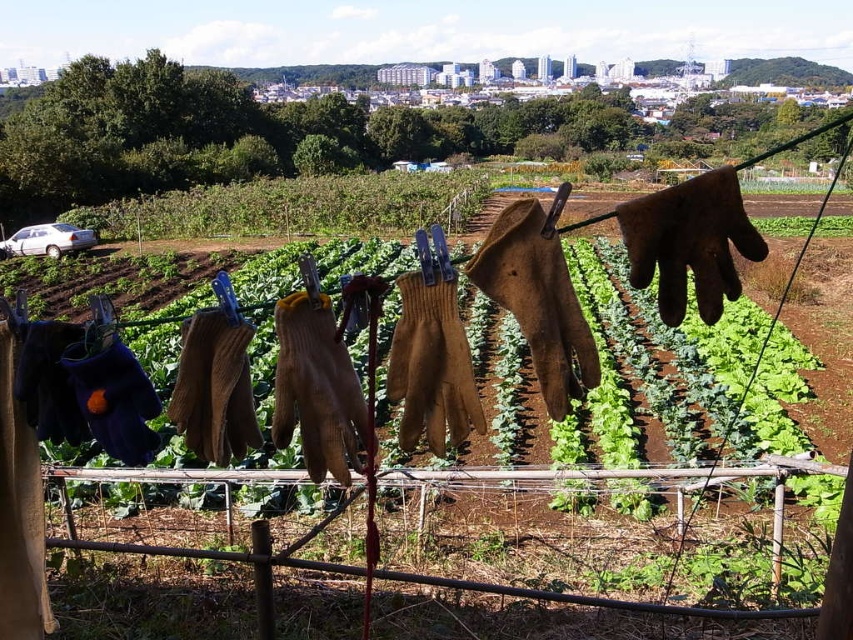
Question: Which object appears closest to the camera in this image?

Choices:
 (A) green leafy at center
 (B) brown wooden fence at center

Answer: (B)

Question: Considering the relative positions of brown wooden fence at center and green leafy at center in the image provided, where is brown wooden fence at center located with respect to green leafy at center?

Choices:
 (A) above
 (B) below

Answer: (B)

Question: Which point appears farthest from the camera in this image?

Choices:
 (A) (567, 602)
 (B) (784, 224)

Answer: (B)

Question: Can you confirm if brown wooden fence at center is positioned to the left of green leafy at center?

Choices:
 (A) yes
 (B) no

Answer: (A)

Question: Which point appears farthest from the camera in this image?

Choices:
 (A) (647, 605)
 (B) (801, 225)

Answer: (B)

Question: Observing the image, what is the correct spatial positioning of brown wooden fence at center in reference to green leafy at center?

Choices:
 (A) below
 (B) above

Answer: (A)